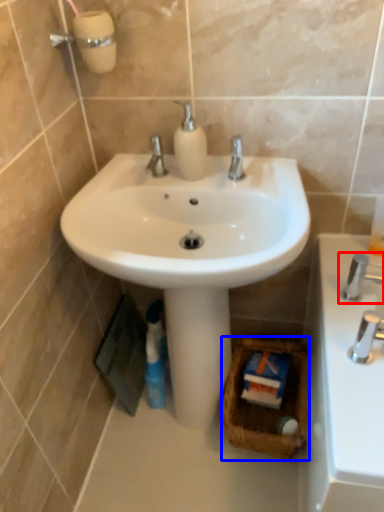
Question: Which object is closer to the camera taking this photo, tap (highlighted by a red box) or basket (highlighted by a blue box)?

Choices:
 (A) tap
 (B) basket

Answer: (A)